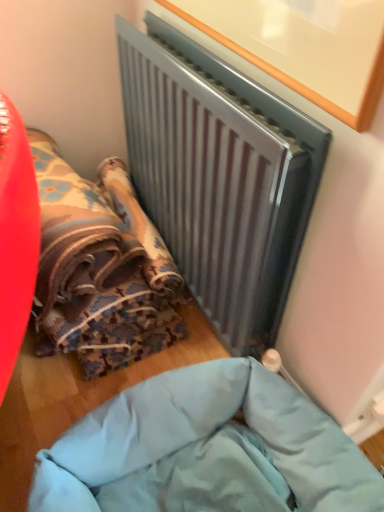
Question: Is metallic gray radiator at upper center spatially inside textured fabric bean bag at lower left, or outside of it?

Choices:
 (A) inside
 (B) outside

Answer: (B)

Question: Is metallic gray radiator at upper center wider or thinner than textured fabric bean bag at lower left?

Choices:
 (A) thin
 (B) wide

Answer: (A)

Question: Which is farther from the light blue fabric at lower center?

Choices:
 (A) metallic gray radiator at upper center
 (B) textured fabric bean bag at lower left

Answer: (A)

Question: Estimate the real-world distances between objects in this image. Which object is farther from the textured fabric bean bag at lower left?

Choices:
 (A) metallic gray radiator at upper center
 (B) light blue fabric at lower center

Answer: (B)